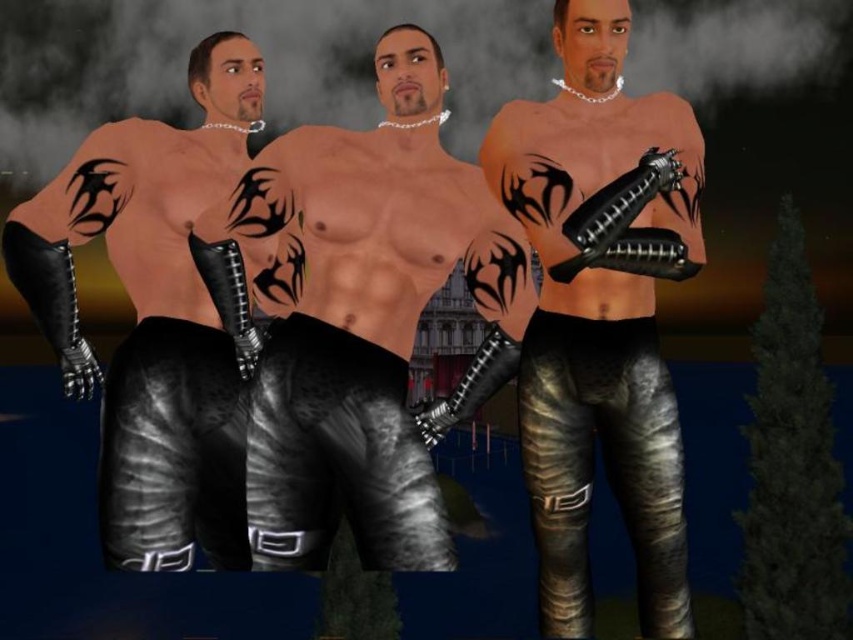
Based on the photo, does shiny black leather pants at center have a larger size compared to matte black leather pants at left?

Yes.

Is point (316, 419) positioned before point (73, 180)?

Yes, point (316, 419) is closer to viewer.

You are a GUI agent. You are given a task and a screenshot of the screen. Output one action in this format:
    pyautogui.click(x=<x>, y=<y>)
    Task: Click on the shiny black leather pants at center
    This screenshot has height=640, width=853.
    Given the screenshot: What is the action you would take?
    pyautogui.click(x=364, y=320)

Can you confirm if metallic black pants at center is positioned to the left of matte black leather pants at left?

In fact, metallic black pants at center is to the right of matte black leather pants at left.

Is metallic black pants at center above matte black leather pants at left?

Incorrect, metallic black pants at center is not positioned above matte black leather pants at left.

Between point (672, 216) and point (178, 314), which one is positioned in front?

Point (672, 216) is more forward.

Where is `metallic black pants at center`? The image size is (853, 640). metallic black pants at center is located at coordinates (596, 323).

Does point (345, 266) lie behind point (570, 292)?

No.

Does shiny black leather pants at center have a greater width compared to metallic black pants at center?

Yes.

This screenshot has width=853, height=640. I want to click on shiny black leather pants at center, so click(364, 320).